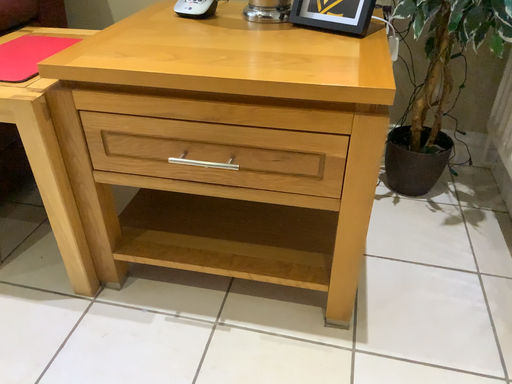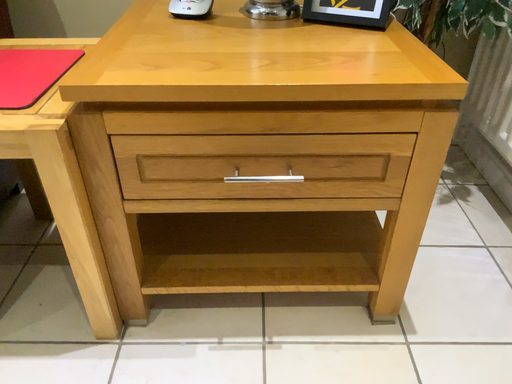
Question: Which way did the camera rotate in the video?

Choices:
 (A) rotated right
 (B) rotated left

Answer: (A)